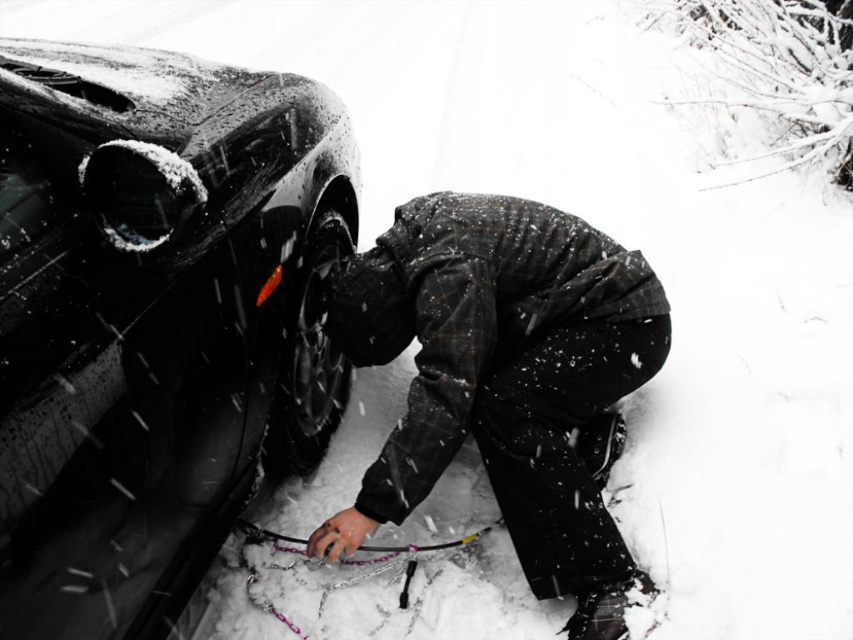
Question: Does glossy black car at left have a smaller size compared to dark woolen jacket at lower center?

Choices:
 (A) no
 (B) yes

Answer: (A)

Question: Which point is closer to the camera taking this photo?

Choices:
 (A) (311, 168)
 (B) (329, 525)
 (C) (265, 426)

Answer: (B)

Question: Which of the following is the farthest from the observer?

Choices:
 (A) black rubber tire at center
 (B) glossy black car at left

Answer: (A)

Question: Is glossy black car at left smaller than black rubber tire at center?

Choices:
 (A) yes
 (B) no

Answer: (B)

Question: Considering the real-world distances, which object is farthest from the dark woolen jacket at lower center?

Choices:
 (A) black rubber tire at center
 (B) glossy black car at left

Answer: (B)

Question: Is glossy black car at left positioned before dark woolen jacket at lower center?

Choices:
 (A) yes
 (B) no

Answer: (A)